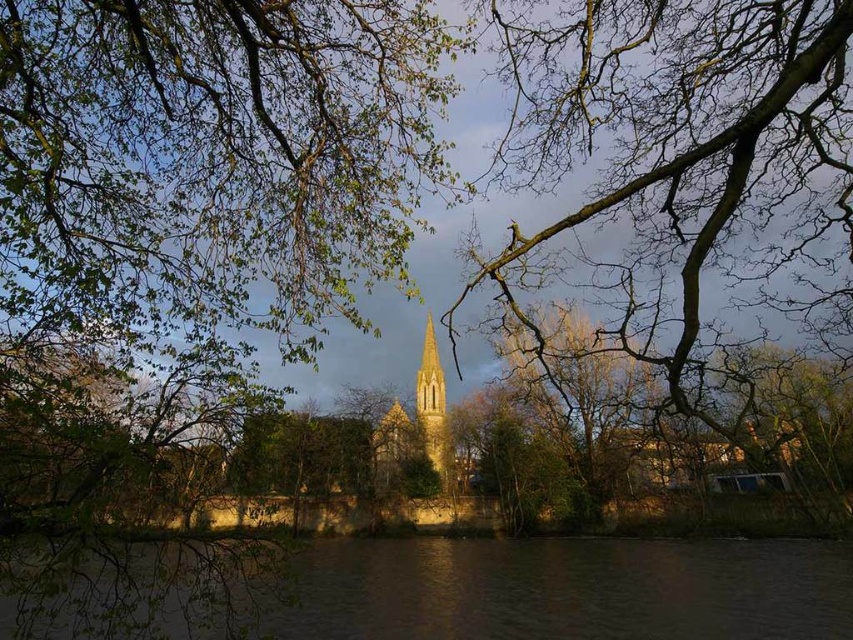
You are an artist trying to sketch this scene. You want to ensure the golden stone church tower at center is visible in your drawing. Should you draw the bare branches at center in front of or behind the tower?

You should draw the bare branches at center in front of the golden stone church tower at center because the bare branches at center is in front of the golden stone church tower at center according to the description.

You are a photographer planning to capture the golden stone church tower at center against the sky. You notice the bare branches at center might block part of the tower. Based on their heights, can you determine if the branches will obscure the tower in your shot?

The bare branches at center has a lesser height compared to golden stone church tower at center, so the branches will not obscure the tower in your shot since they are shorter.

You are an artist setting up an easel to paint the golden stone church tower at center and the bare branches at center. Based on the scene, which object would you need to paint first if you want to follow the rule of painting closer objects before distant ones?

The bare branches at center is bigger than golden stone church tower at center, so you should paint the bare branches at center first since it is closer and appears larger in the foreground.